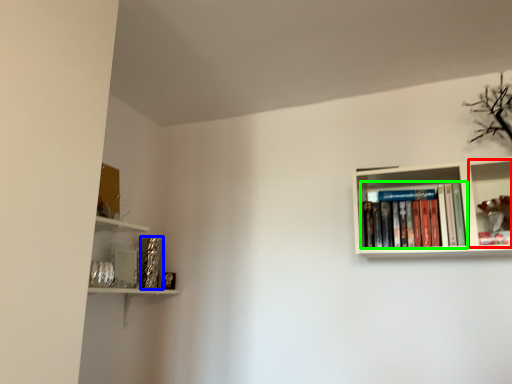
Question: Considering the real-world distances, which object is closest to shelf (highlighted by a red box)? paperback book (highlighted by a blue box) or book (highlighted by a green box).

Choices:
 (A) paperback book
 (B) book

Answer: (B)